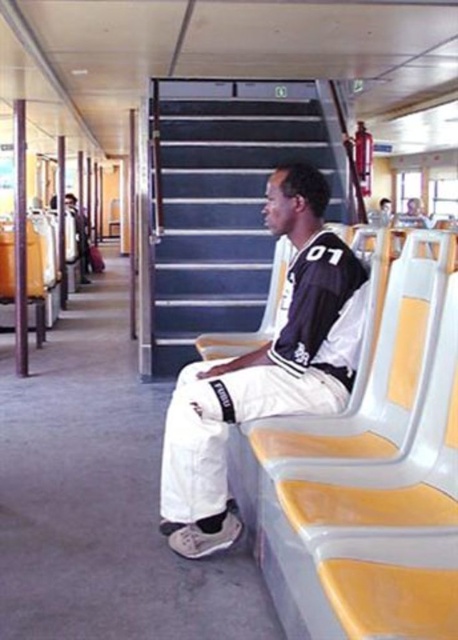
Does white matte pants at center have a greater height compared to matte black shirt at center?

Indeed, white matte pants at center has a greater height compared to matte black shirt at center.

Can you confirm if white matte pants at center is smaller than matte black shirt at center?

Indeed, white matte pants at center has a smaller size compared to matte black shirt at center.

Who is more distant from viewer, (x=256, y=362) or (x=75, y=202)?

The point (x=75, y=202) is behind.

Where is `white matte pants at center`? white matte pants at center is located at coordinates (265, 368).